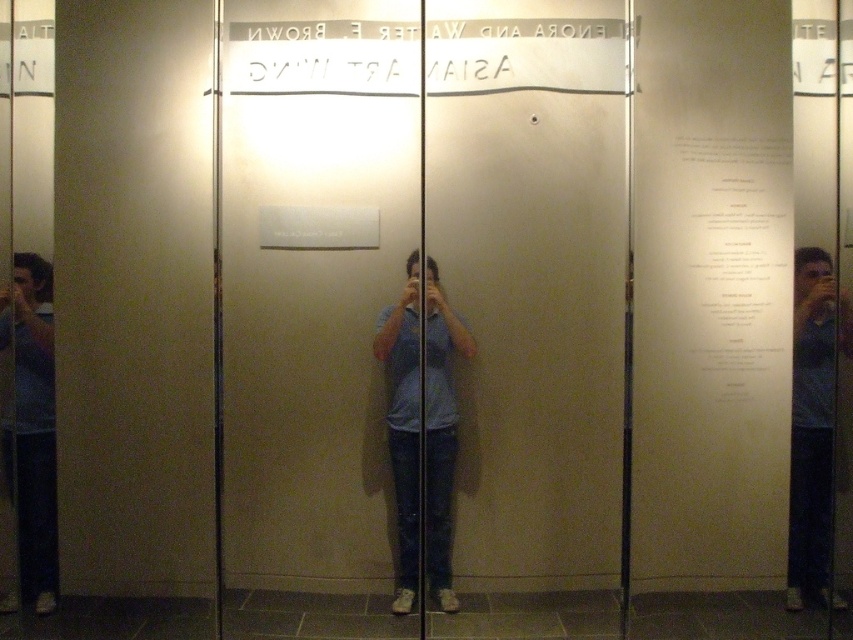
You are standing in front of the glass partition and see two points marked on the glass. The first point is at coordinate point (x=392, y=474) and the second is at point (x=822, y=259). Which point is closer to you?

Point (x=392, y=474) is closer to you because it is further to the viewer than point (x=822, y=259).

You are a delivery person trying to slide a 7.5 inch wide package through a gap between the transparent glass door at center and light blue fabric at center. Can the package fit through the gap?

The gap between the transparent glass door at center and light blue fabric at center is 7.71 inches, so the 7.5 inch wide package can fit through the gap since it is slightly narrower than the available space.

You are a fashion designer observing a model wearing the light blue fabric at center and blue denim jeans at right. Which piece of clothing is positioned to the left of the other?

The light blue fabric at center is positioned to the left of the blue denim jeans at right.